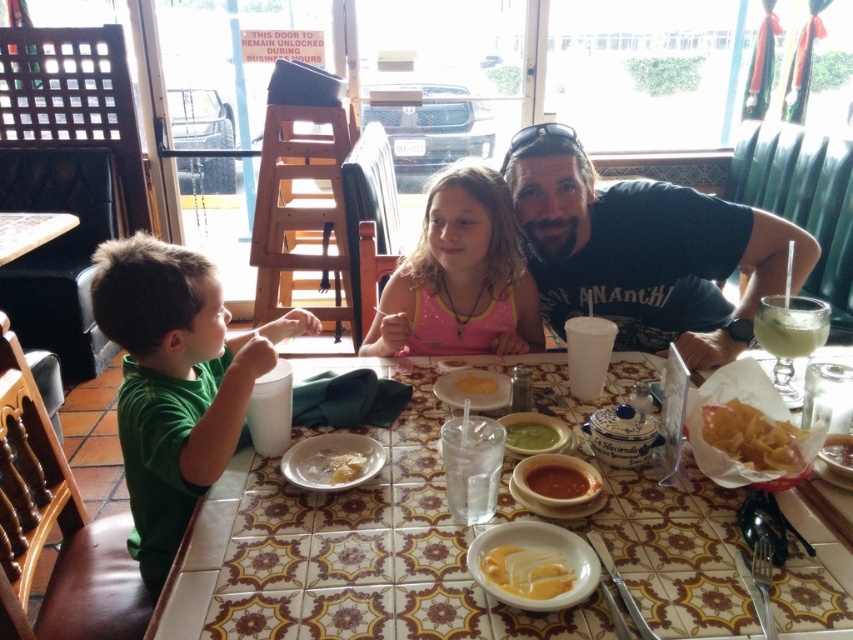
Is yellow creamy sauce at center to the right of white creamy soup at center from the viewer's perspective?

Indeed, yellow creamy sauce at center is positioned on the right side of white creamy soup at center.

Who is higher up, yellow creamy sauce at center or white creamy soup at center?

white creamy soup at center is above.

The image size is (853, 640). I want to click on yellow creamy sauce at center, so click(526, 572).

Find the location of a particular element. yellow creamy sauce at center is located at coordinates (526, 572).

Is black t-shirt at upper right bigger than golden crispy chips at lower right?

Indeed, black t-shirt at upper right has a larger size compared to golden crispy chips at lower right.

Describe the element at coordinates (643, 250) in the screenshot. I see `black t-shirt at upper right` at that location.

The image size is (853, 640). In order to click on black t-shirt at upper right in this screenshot , I will do `click(643, 250)`.

Does smooth tomato sauce at center have a larger size compared to green smoothie at center?

Incorrect, smooth tomato sauce at center is not larger than green smoothie at center.

Locate an element on the screen. The image size is (853, 640). smooth tomato sauce at center is located at coordinates (560, 481).

Locate an element on the screen. Image resolution: width=853 pixels, height=640 pixels. smooth tomato sauce at center is located at coordinates (560, 481).